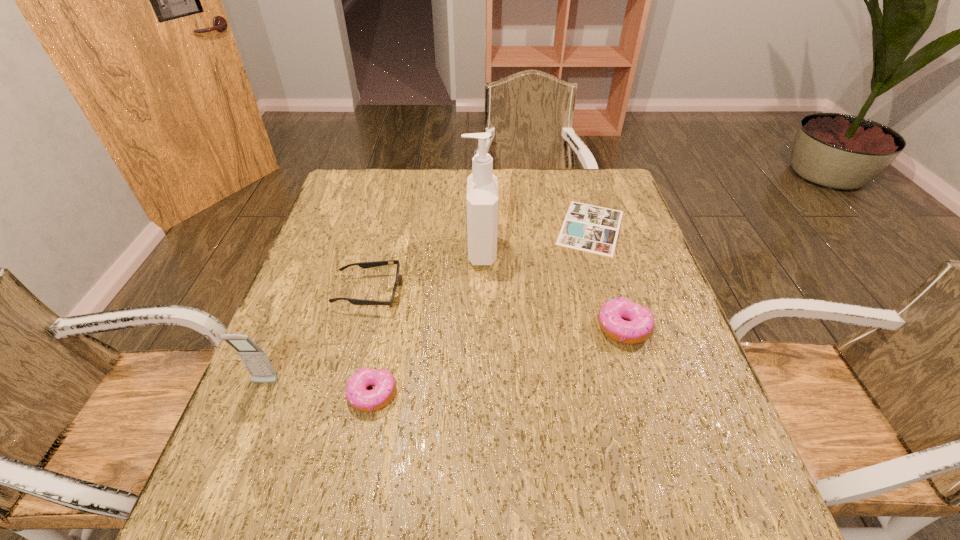
Select which object appears as the fifth closest to the left doughnut. Please provide its 2D coordinates. Your answer should be formatted as a tuple, i.e. [(x, y)], where the tuple contains the x and y coordinates of a point satisfying the conditions above.

[(588, 228)]

I want to click on vacant space that satisfies the following two spatial constraints: 1. on the front-facing side of the sunglasses; 2. on the front-facing side of the second tallest object, so click(x=346, y=383).

This screenshot has height=540, width=960. Find the location of `vacant space that satisfies the following two spatial constraints: 1. on the front-facing side of the leftmost object; 2. on the right side of the left doughnut`. vacant space that satisfies the following two spatial constraints: 1. on the front-facing side of the leftmost object; 2. on the right side of the left doughnut is located at coordinates (261, 395).

Where is `free spot that satisfies the following two spatial constraints: 1. on the front-facing side of the nearer doughnut; 2. on the left side of the fifth shortest object`? free spot that satisfies the following two spatial constraints: 1. on the front-facing side of the nearer doughnut; 2. on the left side of the fifth shortest object is located at coordinates (261, 395).

You are a GUI agent. You are given a task and a screenshot of the screen. Output one action in this format:
    pyautogui.click(x=<x>, y=<y>)
    Task: Click on the free space in the image that satisfies the following two spatial constraints: 1. on the back side of the shortest object; 2. on the right side of the left doughnut
    
    Given the screenshot: What is the action you would take?
    pyautogui.click(x=405, y=227)